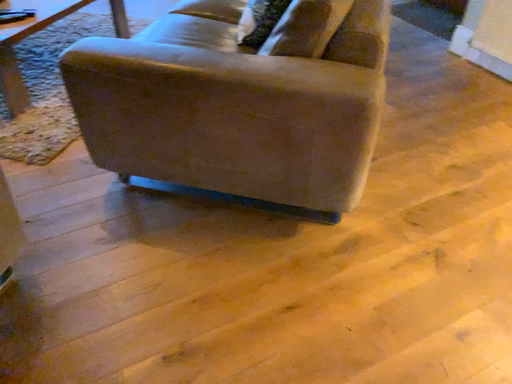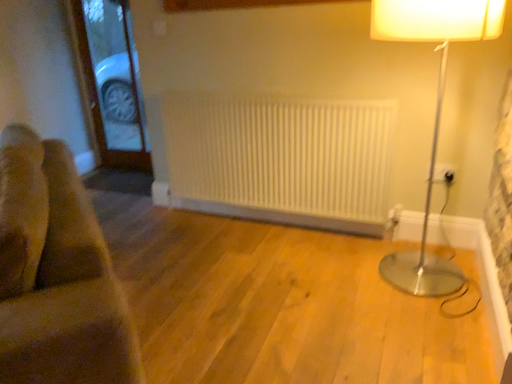
Question: How did the camera likely rotate when shooting the video?

Choices:
 (A) rotated upward
 (B) rotated downward

Answer: (A)